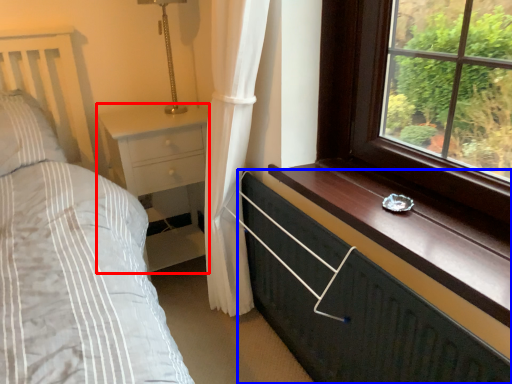
Question: Which object is closer to the camera taking this photo, nightstand (highlighted by a red box) or chest of drawers (highlighted by a blue box)?

Choices:
 (A) nightstand
 (B) chest of drawers

Answer: (B)